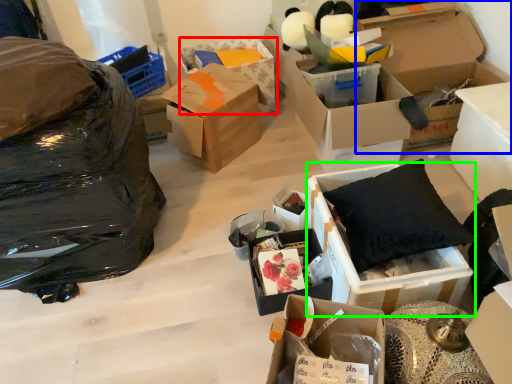
Question: Based on their relative distances, which object is farther from box (highlighted by a red box)? Choose from box (highlighted by a blue box) and box (highlighted by a green box).

Choices:
 (A) box
 (B) box

Answer: (B)